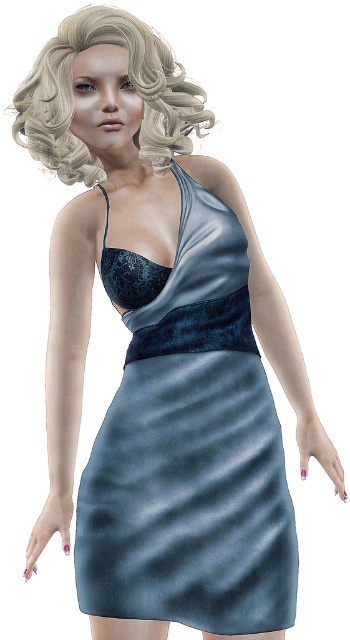
Based on the photo, you are a photographer setting up a shoot. You have a model wearing a satin dress at center and has blonde curly hair at upper left. You want to ensure the dress is the main focus. Since the background is plain white, where should you position the lighting to highlight the dress?

The satin dress at center is below blonde curly hair at upper left. Position the light source below the model to cast shadows upward, keeping the focus on the dress at center rather than the hair at upper left.

Consider the image. You are a photographer setting up for a photoshoot. The subject is wearing a satin dress at center and has blonde curly hair at upper left. You need to ensure that the distance between the dress and the hair is exactly 15 inches for the composition. Based on the scene description, will the current positioning meet this requirement?

The satin dress at center is 15.32 inches away from blonde curly hair at upper left, which is slightly more than the required 15 inches. To meet the exact distance, the subject should adjust their position to reduce the gap by 0.32 inches.

You are a photographer setting up for a photoshoot. You need to ensure that the blonde curly hair at upper left is visible in the frame without being blocked by the satin dress at center. Based on the scene description, can you adjust your camera angle to achieve this?

The blonde curly hair at upper left is behind the satin dress at center, so adjusting the camera angle to position the camera slightly to the side of the satin dress at center would allow the blonde curly hair at upper left to be visible and not blocked.